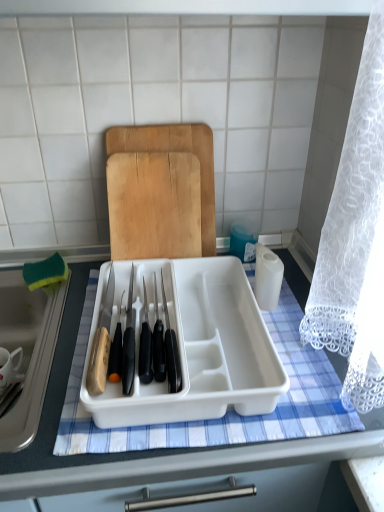
Question: Is white plastic tray at center placed right next to green sponge at left?

Choices:
 (A) yes
 (B) no

Answer: (B)

Question: Is white plastic tray at center wider than green sponge at left?

Choices:
 (A) yes
 (B) no

Answer: (A)

Question: Is white plastic tray at center shorter than green sponge at left?

Choices:
 (A) no
 (B) yes

Answer: (A)

Question: Is white plastic tray at center smaller than green sponge at left?

Choices:
 (A) yes
 (B) no

Answer: (B)

Question: Considering the relative sizes of white plastic tray at center and green sponge at left in the image provided, is white plastic tray at center thinner than green sponge at left?

Choices:
 (A) yes
 (B) no

Answer: (B)

Question: From the image's perspective, is white plastic tray at center above or below green sponge at left?

Choices:
 (A) above
 (B) below

Answer: (A)

Question: From a real-world perspective, is white plastic tray at center positioned above or below green sponge at left?

Choices:
 (A) below
 (B) above

Answer: (B)

Question: Considering the positions of white plastic tray at center and green sponge at left in the image, is white plastic tray at center bigger or smaller than green sponge at left?

Choices:
 (A) small
 (B) big

Answer: (A)

Question: Considering the positions of white plastic tray at center and green sponge at left in the image, is white plastic tray at center wider or thinner than green sponge at left?

Choices:
 (A) thin
 (B) wide

Answer: (A)

Question: From a real-world perspective, relative to white plastic tray at center, is green sponge at left vertically above or below?

Choices:
 (A) above
 (B) below

Answer: (B)

Question: Considering the positions of green sponge at left and white plastic tray at center in the image, is green sponge at left wider or thinner than white plastic tray at center?

Choices:
 (A) thin
 (B) wide

Answer: (B)

Question: In terms of height, does green sponge at left look taller or shorter compared to white plastic tray at center?

Choices:
 (A) short
 (B) tall

Answer: (B)

Question: Based on their sizes in the image, would you say green sponge at left is bigger or smaller than white plastic tray at center?

Choices:
 (A) big
 (B) small

Answer: (A)

Question: Is wooden cutting board at center in front of or behind green sponge at left in the image?

Choices:
 (A) front
 (B) behind

Answer: (B)

Question: Does point (117, 258) appear closer or farther from the camera than point (44, 291)?

Choices:
 (A) closer
 (B) farther

Answer: (A)